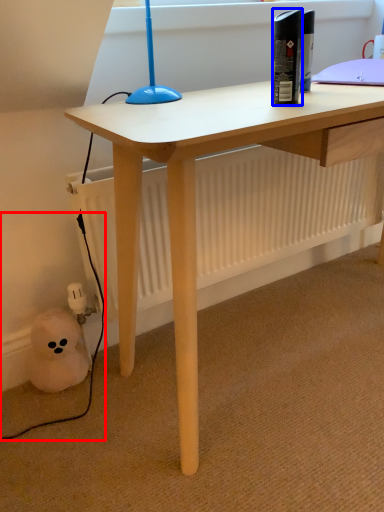
Question: Among these objects, which one is farthest to the camera, cable (highlighted by a red box) or bottle (highlighted by a blue box)?

Choices:
 (A) cable
 (B) bottle

Answer: (A)